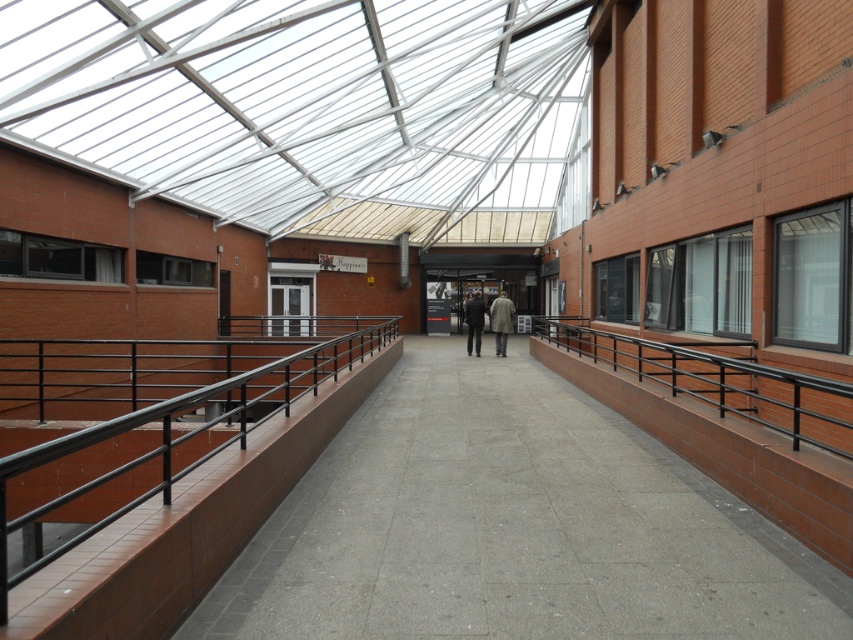
You are standing in the corridor and want to walk from the point at coordinates point (236, 413) to the point at coordinates point (489, 316). Which direction should you move to reach your destination?

To move from point (236, 413) to point (489, 316), you should move backward since point (236, 413) is in front of point (489, 316).